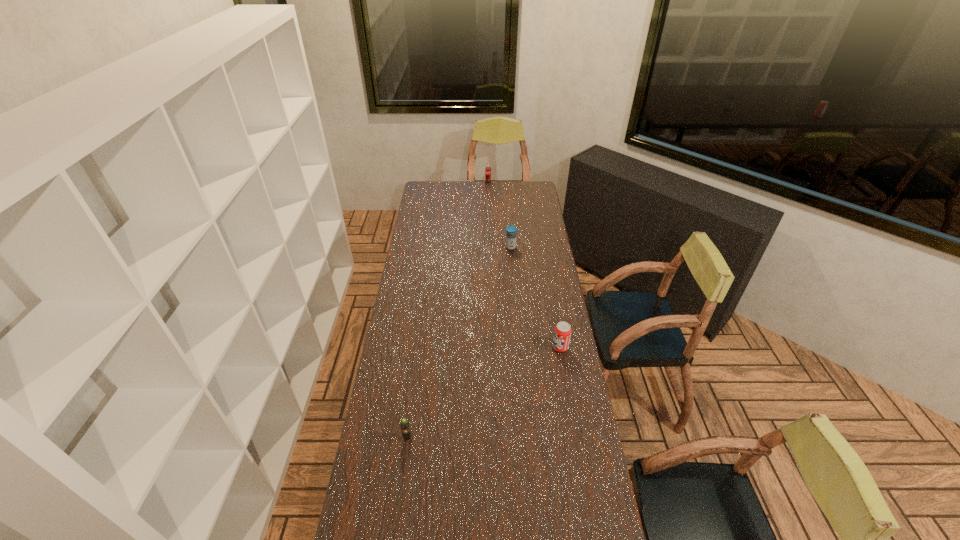
Find the location of a particular element. This screenshot has height=540, width=960. vacant position located on the surface of the second nearest soda is located at coordinates (489, 347).

What are the coordinates of `vacant space positioned on the surface of the second nearest soda` in the screenshot? It's located at (455, 347).

Identify the location of vacant space located 0.130m on the back of the second object from right to left. (509, 230).

Locate an element on the screen. free space located 0.270m on the front label of the leftmost object is located at coordinates (396, 528).

The image size is (960, 540). I want to click on object that is at the far edge, so click(x=488, y=170).

Find the location of `object situated at the left edge`. object situated at the left edge is located at coordinates (405, 428).

This screenshot has height=540, width=960. I want to click on object present at the right edge, so click(x=562, y=333).

Locate an element on the screen. The image size is (960, 540). vacant space at the far edge is located at coordinates (483, 199).

Locate an element on the screen. Image resolution: width=960 pixels, height=540 pixels. vacant space at the left edge is located at coordinates (408, 458).

The width and height of the screenshot is (960, 540). In the image, there is a desktop. Find the location of `vacant space at the right edge`. vacant space at the right edge is located at coordinates (540, 375).